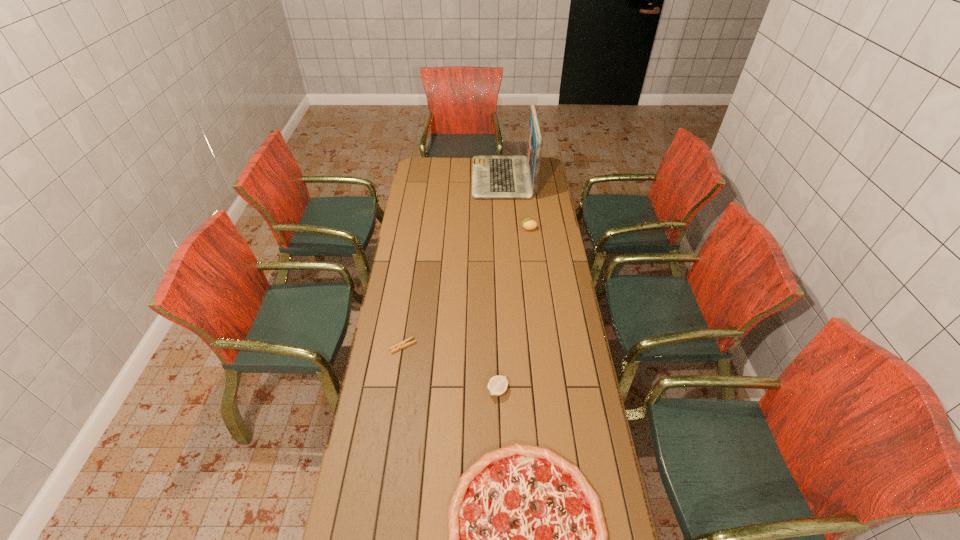
Point out which object is positioned as the nearest to the pizza. Please provide its 2D coordinates. Your answer should be formatted as a tuple, i.e. [(x, y)], where the tuple contains the x and y coordinates of a point satisfying the conditions above.

[(497, 385)]

At what (x,y) coordinates should I click in order to perform the action: click on vacant area that satisfies the following two spatial constraints: 1. on the screen of the tallest object; 2. on the front side of the leftmost object. Please return your answer as a coordinate pair (x, y). This screenshot has height=540, width=960. Looking at the image, I should click on (515, 346).

Locate an element on the screen. vacant space that satisfies the following two spatial constraints: 1. on the screen of the farthest object; 2. on the front side of the third tallest object is located at coordinates (517, 390).

Locate an element on the screen. This screenshot has width=960, height=540. free spot that satisfies the following two spatial constraints: 1. on the front side of the fourth farthest object; 2. on the left side of the shortest object is located at coordinates (x=396, y=390).